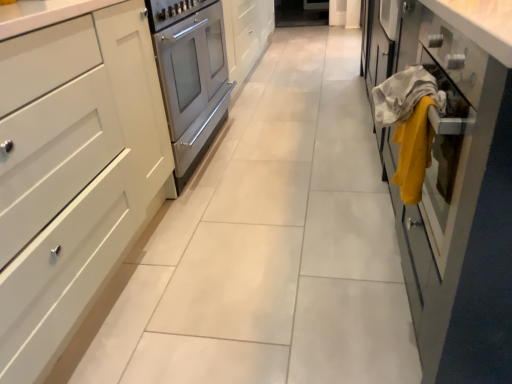
Question: From a real-world perspective, is yellow fabric at right, positioned as the 2th blanket in right-to-left order, under yellow fabric at right, the 1th blanket when ordered from right to left?

Choices:
 (A) no
 (B) yes

Answer: (A)

Question: Does yellow fabric at right, positioned as the 2th blanket in right-to-left order, appear on the right side of yellow fabric at right, the 1th blanket when ordered from right to left?

Choices:
 (A) yes
 (B) no

Answer: (B)

Question: Considering the relative sizes of yellow fabric at right, positioned as the 2th blanket in right-to-left order, and yellow fabric at right, the 1th blanket when ordered from right to left, in the image provided, is yellow fabric at right, positioned as the 2th blanket in right-to-left order, bigger than yellow fabric at right, the 1th blanket when ordered from right to left,?

Choices:
 (A) yes
 (B) no

Answer: (A)

Question: Does yellow fabric at right, positioned as the 2th blanket in right-to-left order, have a lesser height compared to yellow fabric at right, the second blanket from the left?

Choices:
 (A) no
 (B) yes

Answer: (A)

Question: Is yellow fabric at right, positioned as the 2th blanket in right-to-left order, not near yellow fabric at right, the 1th blanket when ordered from right to left?

Choices:
 (A) yes
 (B) no

Answer: (B)

Question: Considering their positions, is white matte cabinet at left, marked as the 1th cabinetry in a left-to-right arrangement, located in front of or behind yellow fabric at right, positioned as the 2th blanket in right-to-left order?

Choices:
 (A) front
 (B) behind

Answer: (A)

Question: Considering the positions of white matte cabinet at left, marked as the 1th cabinetry in a left-to-right arrangement, and yellow fabric at right, positioned as the 2th blanket in right-to-left order, in the image, is white matte cabinet at left, marked as the 1th cabinetry in a left-to-right arrangement, bigger or smaller than yellow fabric at right, positioned as the 2th blanket in right-to-left order,?

Choices:
 (A) small
 (B) big

Answer: (B)

Question: Would you say white matte cabinet at left, marked as the 1th cabinetry in a left-to-right arrangement, is to the left or to the right of yellow fabric at right, marked as the 1th blanket in a left-to-right arrangement, in the picture?

Choices:
 (A) left
 (B) right

Answer: (A)

Question: From a real-world perspective, is white matte cabinet at left, marked as the 1th cabinetry in a left-to-right arrangement, above or below yellow fabric at right, positioned as the 2th blanket in right-to-left order?

Choices:
 (A) above
 (B) below

Answer: (B)

Question: From a real-world perspective, is matte glass cabinet at right, the second cabinetry when ordered from left to right, above or below yellow fabric at right, marked as the 1th blanket in a left-to-right arrangement?

Choices:
 (A) below
 (B) above

Answer: (B)

Question: From their relative heights in the image, would you say matte glass cabinet at right, placed as the 1th cabinetry when sorted from right to left, is taller or shorter than yellow fabric at right, positioned as the 2th blanket in right-to-left order?

Choices:
 (A) tall
 (B) short

Answer: (A)

Question: Is point (480, 220) closer or farther from the camera than point (402, 104)?

Choices:
 (A) farther
 (B) closer

Answer: (B)

Question: Which is correct: matte glass cabinet at right, the second cabinetry when ordered from left to right, is inside yellow fabric at right, positioned as the 2th blanket in right-to-left order, or outside of it?

Choices:
 (A) inside
 (B) outside

Answer: (B)

Question: From their relative heights in the image, would you say yellow fabric at right, the second blanket from the left, is taller or shorter than yellow fabric at right, marked as the 1th blanket in a left-to-right arrangement?

Choices:
 (A) tall
 (B) short

Answer: (B)

Question: From a real-world perspective, is yellow fabric at right, the second blanket from the left, positioned above or below yellow fabric at right, positioned as the 2th blanket in right-to-left order?

Choices:
 (A) above
 (B) below

Answer: (B)